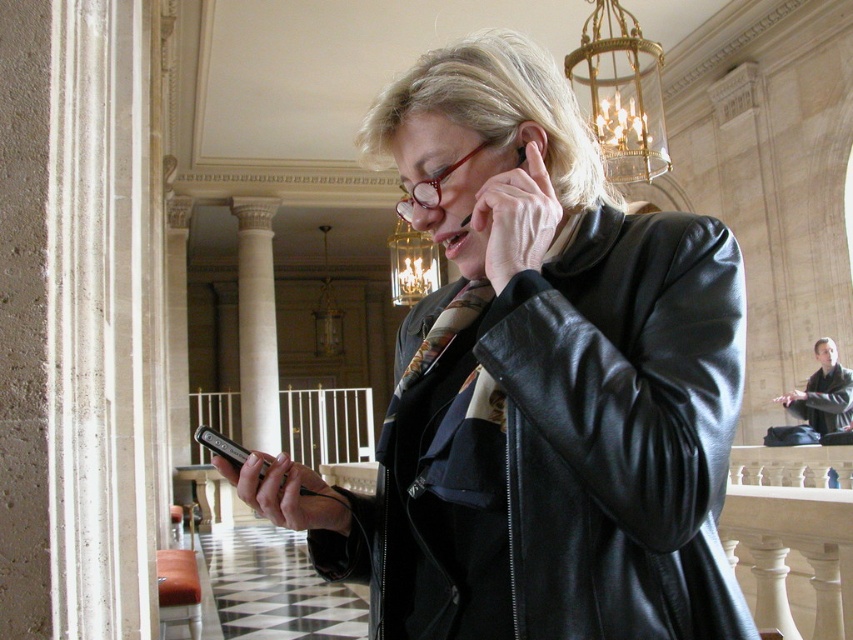
Who is shorter, gold metallic chandelier at upper center or dark brown leather jacket at right?

dark brown leather jacket at right

Who is positioned more to the right, gold metallic chandelier at upper center or dark brown leather jacket at right?

dark brown leather jacket at right

Is point (648, 74) positioned after point (813, 342)?

No, it is not.

Identify the location of gold metallic chandelier at upper center. (619, 92).

In the scene shown: How distant is white marble column at center from multicolored silk tie at center?

They are 22.42 meters apart.

Between white marble column at center and multicolored silk tie at center, which one is positioned higher?

white marble column at center is higher up.

Between point (257, 317) and point (428, 340), which one is positioned behind?

Point (257, 317)

Identify the location of white marble column at center. (256, 324).

Which is more to the left, gold metallic chandelier at upper center or multicolored silk tie at center?

Positioned to the left is multicolored silk tie at center.

Locate an element on the screen. This screenshot has width=853, height=640. gold metallic chandelier at upper center is located at coordinates (619, 92).

What are the coordinates of `gold metallic chandelier at upper center` in the screenshot? It's located at (619, 92).